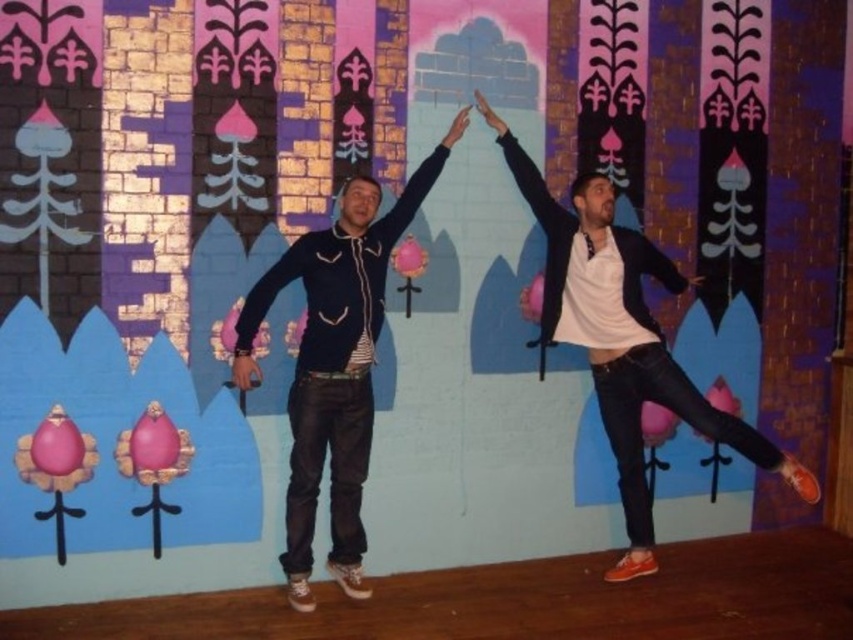
You are a photographer at the event and need to arrange the two people so that the matte black jacket at center and the matte black hoodie at center are visible in the photo. According to the current setup, which one is on the right side when viewed from the front?

The matte black jacket at center is positioned on the right side of the matte black hoodie at center, so when viewed from the front, the matte black jacket at center is on the right side.

You are a photographer setting up a shoot on the stage. You need to decide which clothing item to focus on first based on their sizes. Which one should you focus on first, the matte black jacket at center or the matte black hoodie at center?

The matte black jacket at center is larger in size than the matte black hoodie at center, so you should focus on the matte black jacket at center first since it is bigger and might require more attention in the frame.